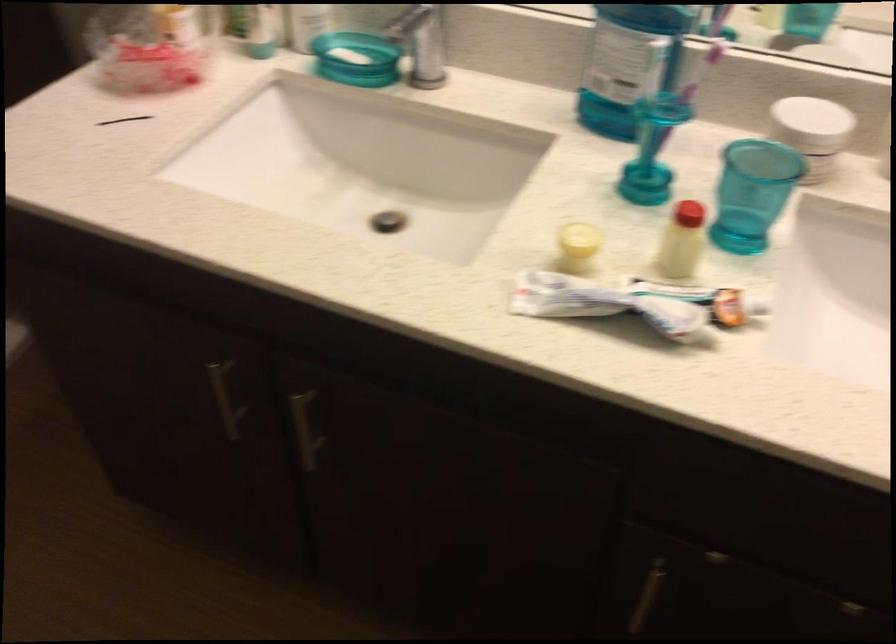
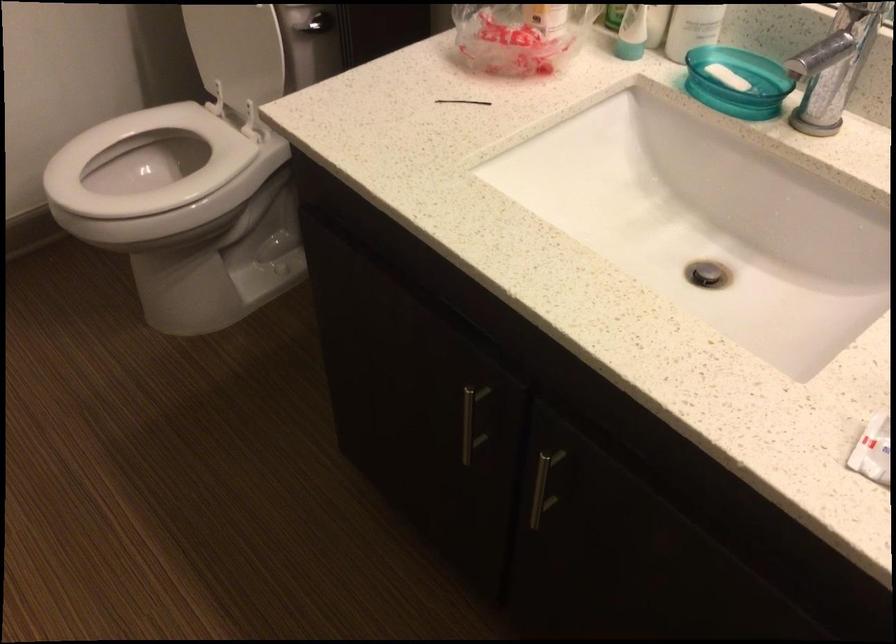
Find the pixel in the second image that matches [125,122] in the first image.

(462, 102)